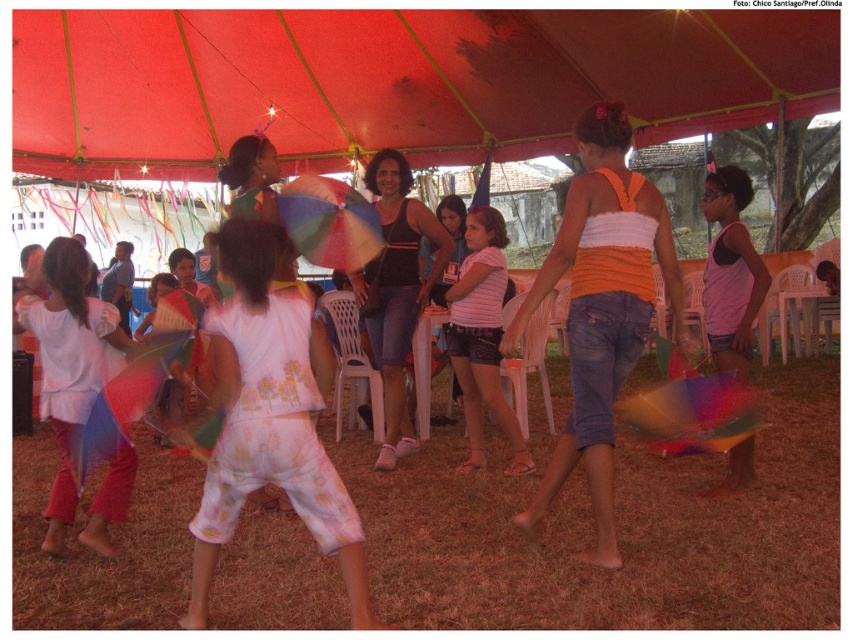
You are a photographer trying to capture a photo of the red fabric canopy at upper center and the pink striped shirt at center. Based on their positions, which object should you adjust your camera to focus on first if you want to ensure both are in the frame without moving the camera?

The red fabric canopy at upper center is to the left of the pink striped shirt at center. To capture both in the frame without moving the camera, focus on the red fabric canopy at upper center first since it is positioned to the left, ensuring the pink striped shirt at center remains within the right side of the frame.